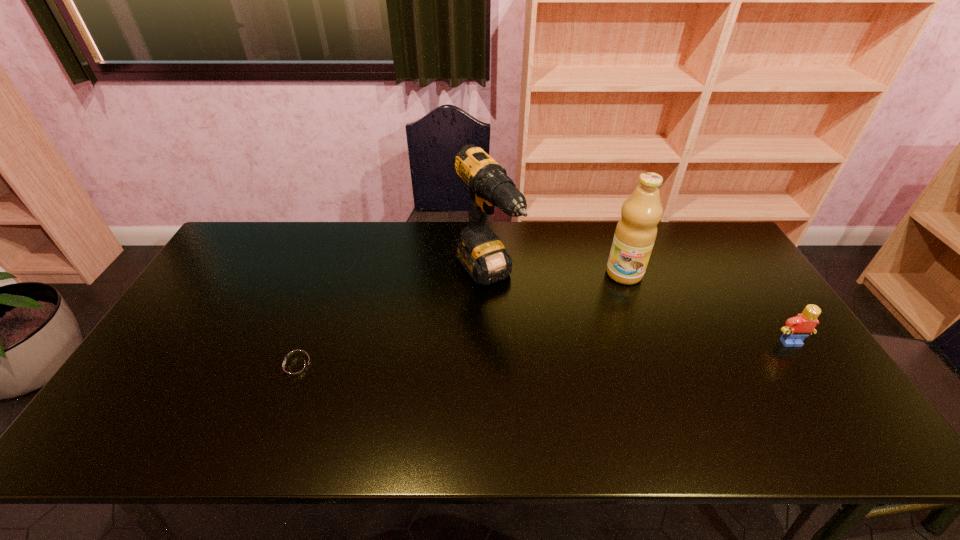
You are a GUI agent. You are given a task and a screenshot of the screen. Output one action in this format:
    pyautogui.click(x=<x>, y=<y>)
    Task: Click on the shortest object
    
    Given the screenshot: What is the action you would take?
    pyautogui.click(x=295, y=368)

At what (x,y) coordinates should I click in order to perform the action: click on watch. Please return your answer as a coordinate pair (x, y). The image size is (960, 540). Looking at the image, I should click on (295, 368).

Locate an element on the screen. The width and height of the screenshot is (960, 540). the rightmost object is located at coordinates (795, 330).

The width and height of the screenshot is (960, 540). In order to click on Lego in this screenshot , I will do `click(795, 330)`.

The width and height of the screenshot is (960, 540). In order to click on drill in this screenshot , I will do `click(482, 254)`.

The width and height of the screenshot is (960, 540). I want to click on the second object from right to left, so click(x=636, y=231).

This screenshot has height=540, width=960. Identify the location of vacant point located on the face of the watch. (160, 368).

You are a GUI agent. You are given a task and a screenshot of the screen. Output one action in this format:
    pyautogui.click(x=<x>, y=<y>)
    Task: Click on the vacant area situated on the face of the watch
    Image resolution: width=960 pixels, height=540 pixels.
    Given the screenshot: What is the action you would take?
    pyautogui.click(x=195, y=368)

I want to click on vacant position located on the face of the watch, so click(x=191, y=368).

The width and height of the screenshot is (960, 540). In order to click on vacant space located 0.130m on the front-facing side of the Lego in this screenshot , I will do `click(822, 388)`.